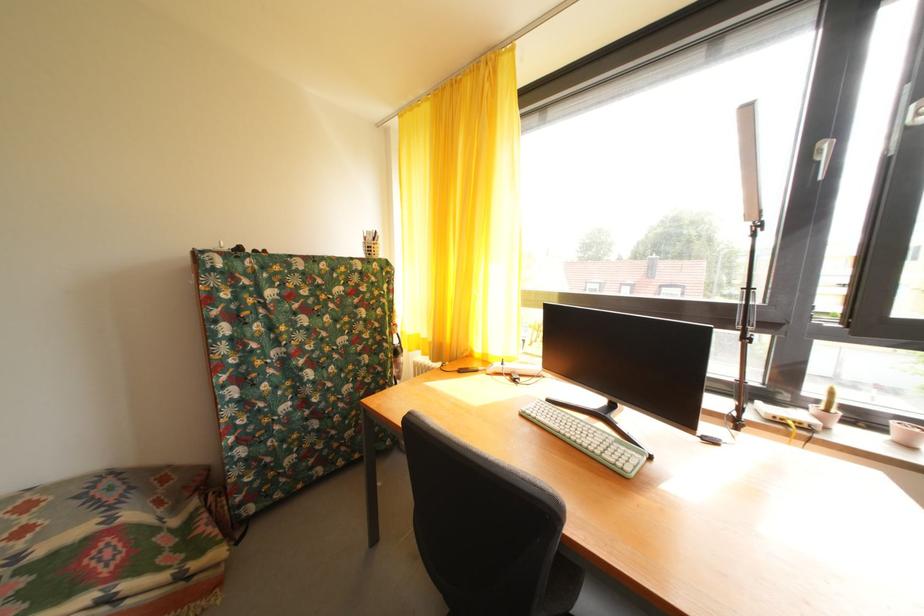
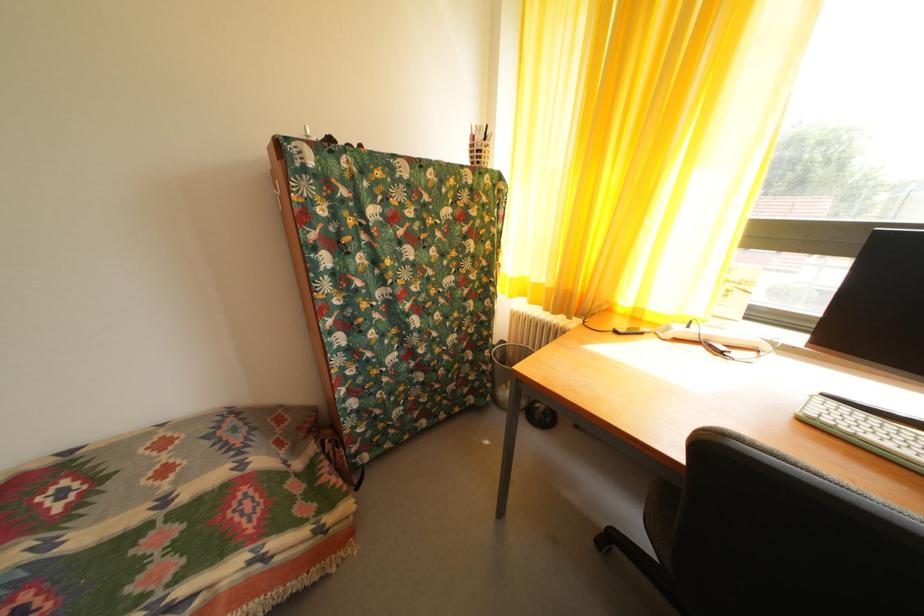
Which direction would the cameraman need to move to produce the second image?

The cameraman walked toward left, forward.